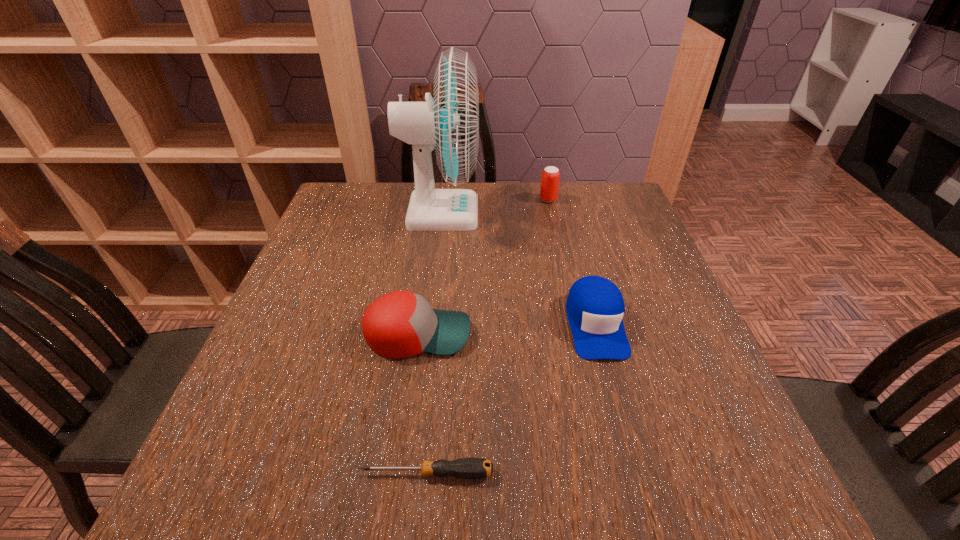
The height and width of the screenshot is (540, 960). I want to click on free space at the near left corner of the desktop, so click(x=204, y=478).

In the image, there is a desktop. Identify the location of vacant space at the near right corner. Image resolution: width=960 pixels, height=540 pixels. (750, 491).

You are a GUI agent. You are given a task and a screenshot of the screen. Output one action in this format:
    pyautogui.click(x=<x>, y=<y>)
    Task: Click on the unoccupied area between the right baseball cap and the screwdriver
    This screenshot has height=540, width=960.
    Given the screenshot: What is the action you would take?
    pyautogui.click(x=512, y=399)

You are a GUI agent. You are given a task and a screenshot of the screen. Output one action in this format:
    pyautogui.click(x=<x>, y=<y>)
    Task: Click on the free point between the fan and the beer can
    
    Given the screenshot: What is the action you would take?
    494,206

Locate an element on the screen. This screenshot has width=960, height=540. free spot between the tallest object and the right baseball cap is located at coordinates (518, 268).

Where is `vacant area between the right baseball cap and the left baseball cap`? This screenshot has width=960, height=540. vacant area between the right baseball cap and the left baseball cap is located at coordinates (507, 329).

Where is `empty location between the left baseball cap and the beer can`? The image size is (960, 540). empty location between the left baseball cap and the beer can is located at coordinates (483, 267).

You are a GUI agent. You are given a task and a screenshot of the screen. Output one action in this format:
    pyautogui.click(x=<x>, y=<y>)
    Task: Click on the vacant region between the left baseball cap and the screwdriver
    This screenshot has width=960, height=540.
    Given the screenshot: What is the action you would take?
    pyautogui.click(x=423, y=404)

Where is `free spot between the right baseball cap and the tallest object`? Image resolution: width=960 pixels, height=540 pixels. free spot between the right baseball cap and the tallest object is located at coordinates (518, 268).

Where is `free space between the left baseball cap and the beer can`? free space between the left baseball cap and the beer can is located at coordinates (483, 267).